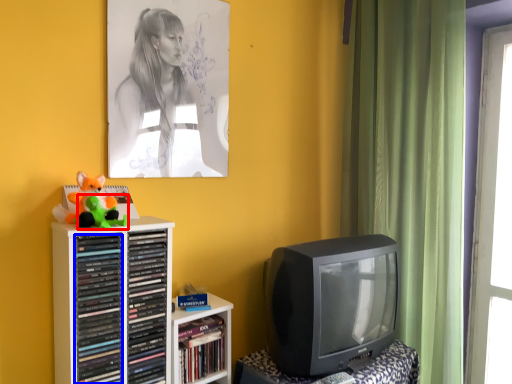
Question: Which object is closer to the camera taking this photo, toy (highlighted by a red box) or book (highlighted by a blue box)?

Choices:
 (A) toy
 (B) book

Answer: (A)